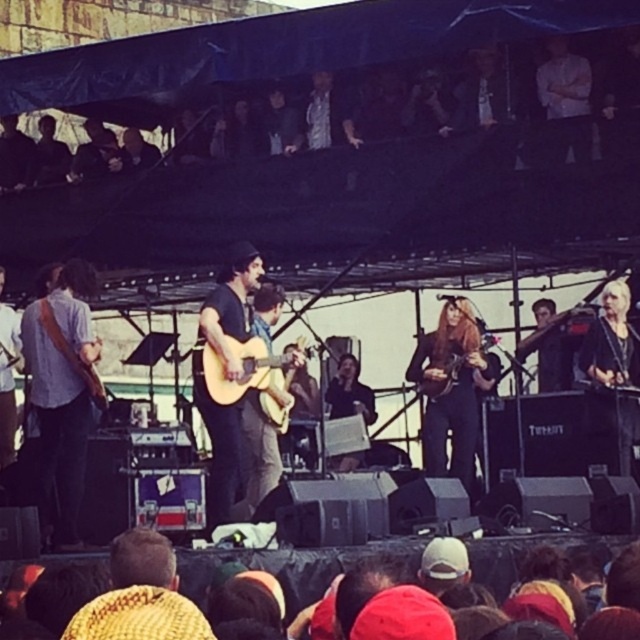
You are a photographer at the concert and want to capture both the guitarist in a black shirt and jeans and the woman with long hair playing an instrument. You notice two points marked on your camera screen at coordinates point (284, 404) and point (426, 346). Which point is closer to the guitarist in a black shirt and jeans?

Point (284, 404) is in front of point (426, 346), so it is closer to the guitarist in a black shirt and jeans.

You are a photographer at the concert and want to capture both the light brown acoustic guitar at center and the wooden acoustic guitar at center in a single shot. Since you can only focus on one guitar at a time, which guitar should you focus on to ensure the other is still in the frame?

The light brown acoustic guitar at center is to the left of wooden acoustic guitar at center, so focusing on the wooden acoustic guitar at center would keep the light brown acoustic guitar at center in the frame as it is positioned to the left.

You are a photographer standing at the edge of the concert venue. You want to take a closeup shot of the light brown acoustic guitar at center. Given that your camera has a maximum zoom range of 50 meters, can you capture the guitar clearly?

The light brown acoustic guitar at center is 58.71 meters away from the viewer. Since the camera can only zoom up to 50 meters, it cannot capture the guitar clearly at this distance.